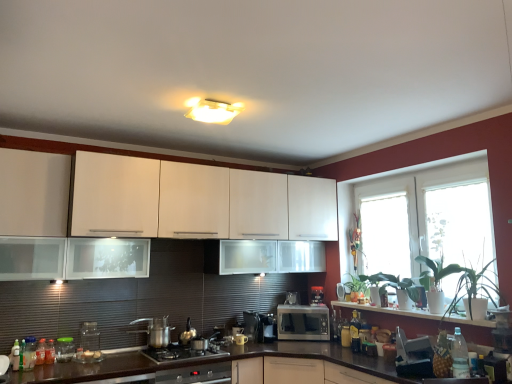
This screenshot has height=384, width=512. Identify the location of free space in front of matte glass mug at center, the 5th appliance viewed from the left. (295, 311).